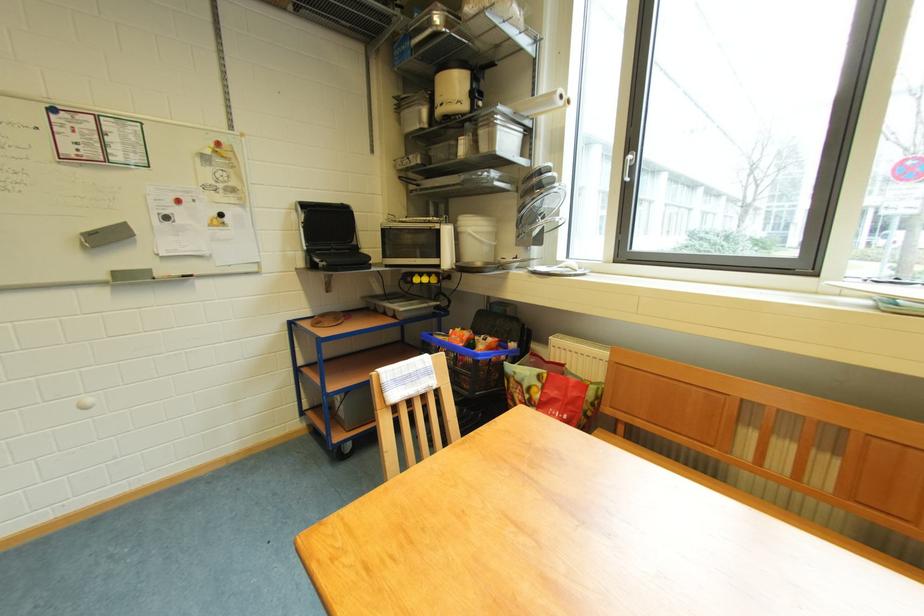
What are the coordinates of `plastic wrap roll` in the screenshot? It's located at (407, 379).